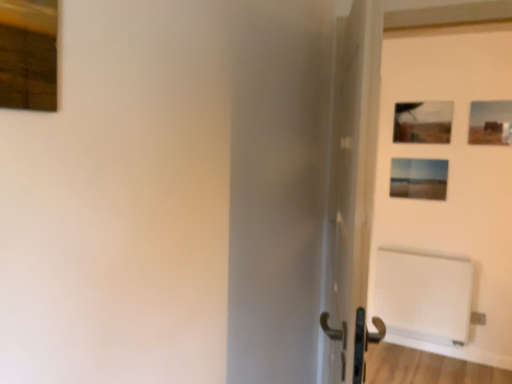
Question: Is matte wooden picture frame at center-right, which ranks as the fourth picture frame in front-to-back order, facing towards wooden frame at upper left, the first picture frame in the left-to-right sequence?

Choices:
 (A) no
 (B) yes

Answer: (B)

Question: Could wooden frame at upper left, which ranks as the 1th picture frame in front-to-back order, be considered to be inside matte wooden picture frame at center-right, placed as the 3th picture frame when sorted from right to left?

Choices:
 (A) yes
 (B) no

Answer: (B)

Question: Considering the relative sizes of matte wooden picture frame at center-right, which ranks as the 2th picture frame in left-to-right order, and wooden frame at upper left, the 4th picture frame in the right-to-left sequence, in the image provided, is matte wooden picture frame at center-right, which ranks as the 2th picture frame in left-to-right order, taller than wooden frame at upper left, the 4th picture frame in the right-to-left sequence,?

Choices:
 (A) yes
 (B) no

Answer: (A)

Question: Does matte wooden picture frame at center-right, which ranks as the 2th picture frame in left-to-right order, have a larger size compared to wooden frame at upper left, the 4th picture frame from the back?

Choices:
 (A) no
 (B) yes

Answer: (B)

Question: Does matte wooden picture frame at center-right, which ranks as the 2th picture frame in left-to-right order, have a lesser width compared to wooden frame at upper left, the first picture frame in the left-to-right sequence?

Choices:
 (A) yes
 (B) no

Answer: (B)

Question: Relative to matte wooden picture frame at upper right, arranged as the third picture frame when viewed from the back, is matte black picture frame at upper right, the 3th picture frame from the front, in front or behind?

Choices:
 (A) behind
 (B) front

Answer: (A)

Question: Is matte black picture frame at upper right, the 3th picture frame from the front, wider or thinner than matte wooden picture frame at upper right, which is the 2th picture frame in front-to-back order?

Choices:
 (A) thin
 (B) wide

Answer: (A)

Question: Is point (403, 130) positioned closer to the camera than point (508, 115)?

Choices:
 (A) closer
 (B) farther

Answer: (B)

Question: From a real-world perspective, relative to matte wooden picture frame at upper right, arranged as the third picture frame when viewed from the back, is matte black picture frame at upper right, which is the 3th picture frame from left to right, vertically above or below?

Choices:
 (A) above
 (B) below

Answer: (B)

Question: Is matte wooden picture frame at center-right, which ranks as the fourth picture frame in front-to-back order, in front of or behind matte black picture frame at upper right, the 3th picture frame from the front, in the image?

Choices:
 (A) behind
 (B) front

Answer: (A)

Question: Is matte wooden picture frame at center-right, positioned as the 1th picture frame in back-to-front order, wider or thinner than matte black picture frame at upper right, which is the 2th picture frame in back-to-front order?

Choices:
 (A) wide
 (B) thin

Answer: (A)

Question: Does point (399, 173) appear closer or farther from the camera than point (428, 127)?

Choices:
 (A) closer
 (B) farther

Answer: (B)

Question: Is matte wooden picture frame at center-right, which ranks as the fourth picture frame in front-to-back order, taller or shorter than matte black picture frame at upper right, which is the 3th picture frame from left to right?

Choices:
 (A) tall
 (B) short

Answer: (B)

Question: Is point (504, 122) positioned closer to the camera than point (418, 119)?

Choices:
 (A) farther
 (B) closer

Answer: (B)

Question: From the image's perspective, relative to matte black picture frame at upper right, the 3th picture frame from the front, is matte wooden picture frame at upper right, which is the 2th picture frame in front-to-back order, above or below?

Choices:
 (A) above
 (B) below

Answer: (B)